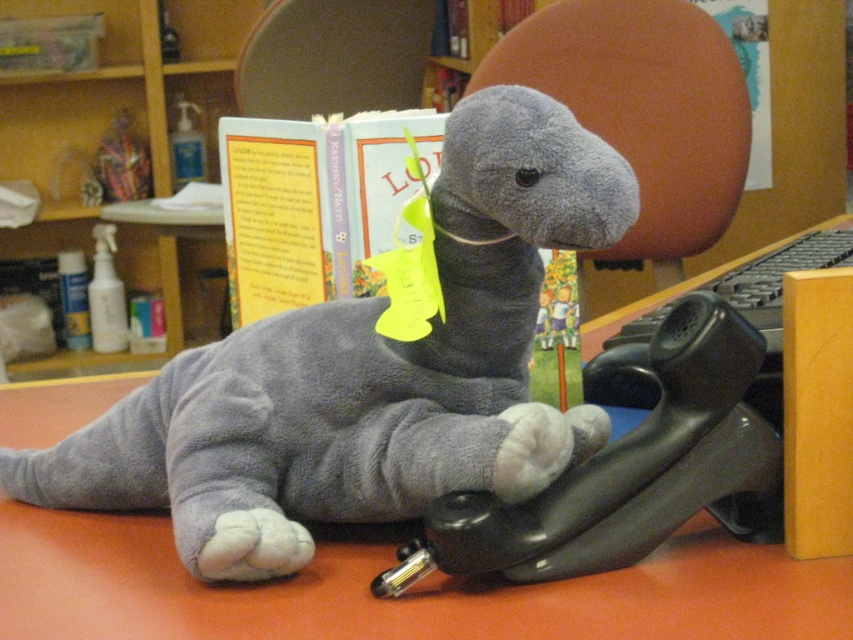
In the scene shown: You are organizing a childrens birthday party and need to place the gray plush dinosaur at center and the black rubber telephone at lower center on a small table. Given their sizes, which object should you place first to ensure both fit comfortably?

The gray plush dinosaur at center should be placed first because it has a larger size compared to the black rubber telephone at lower center, ensuring there is enough space left for the smaller telephone.

You are organizing items on a desk and need to place a new item between the black rubber telephone at lower center and the light blue paper book at center. Based on their current positions, which item is closer to you, making it easier to reach?

The black rubber telephone at lower center is closer to you since it is in front of the light blue paper book at center, so it is easier to reach.